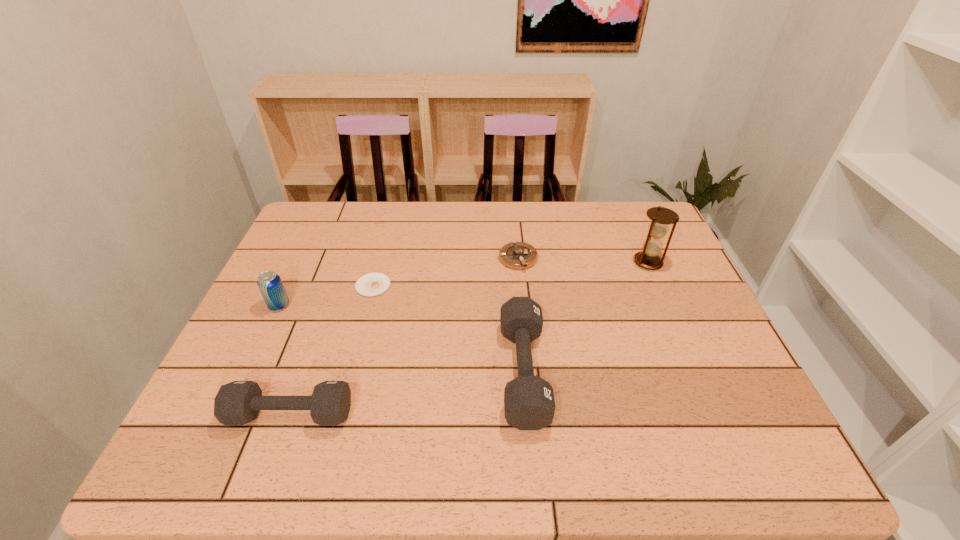
Considering the uniform spacing of dumbbells, where should an additional dumbbell be positioned on the right? Please locate a free spot. Please provide its 2D coordinates. Your answer should be formatted as a tuple, i.e. [(x, y)], where the tuple contains the x and y coordinates of a point satisfying the conditions above.

[(722, 336)]